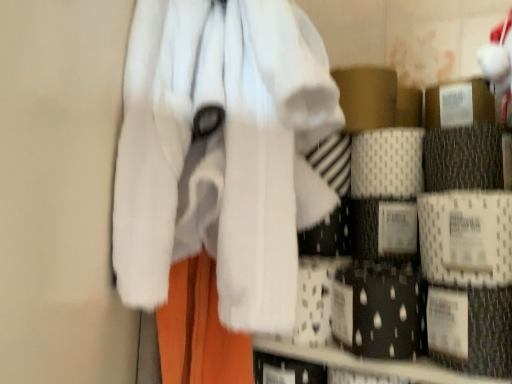
This screenshot has height=384, width=512. I want to click on white fluffy towel at upper center, so click(x=222, y=153).

This screenshot has height=384, width=512. Describe the element at coordinates (222, 153) in the screenshot. I see `white fluffy towel at upper center` at that location.

This screenshot has width=512, height=384. Find the location of `white fluffy towel at upper center`. white fluffy towel at upper center is located at coordinates click(222, 153).